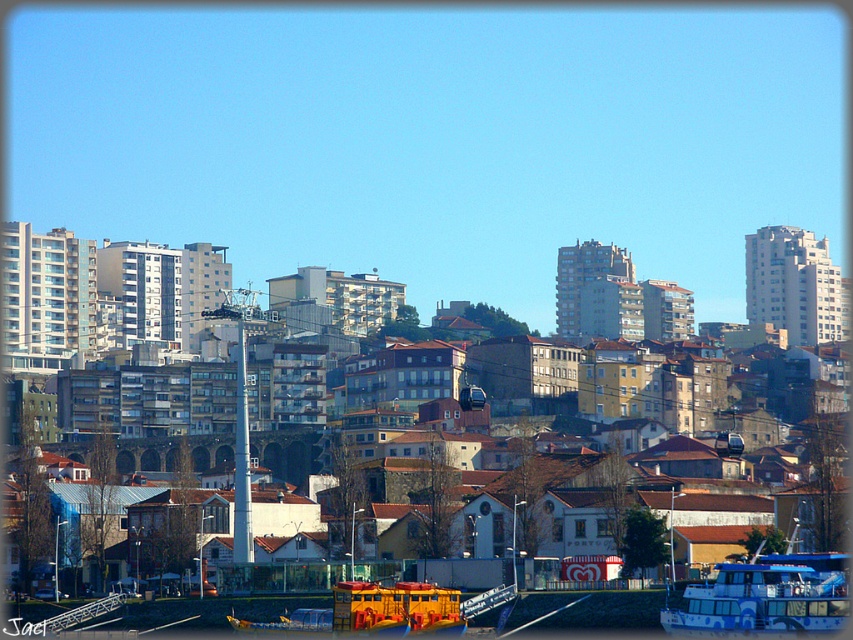
Looking at this image, measure the distance between point (843, 554) and camera.

Point (843, 554) is 459.39 feet away from camera.

The width and height of the screenshot is (853, 640). Find the location of `blue glossy boat at lower right`. blue glossy boat at lower right is located at coordinates (766, 596).